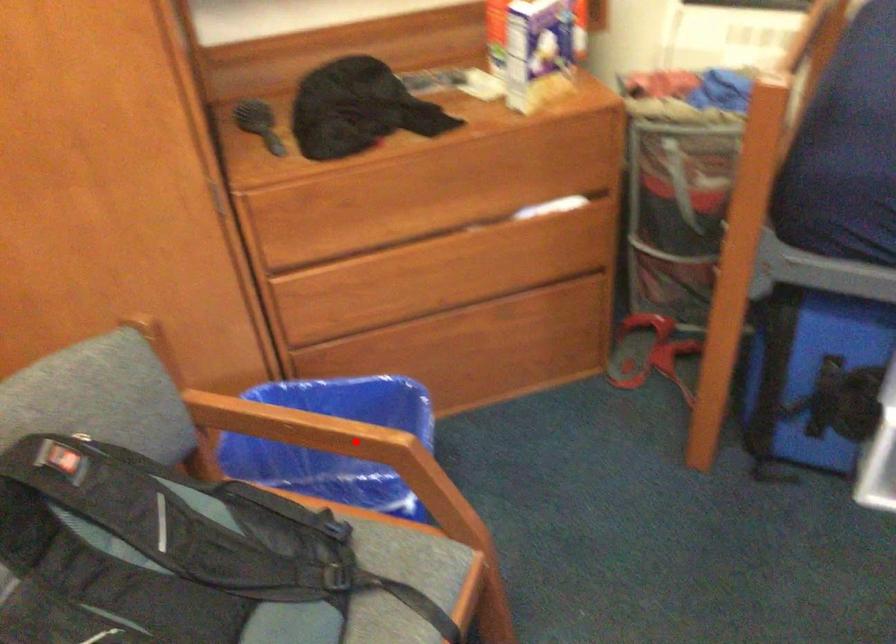
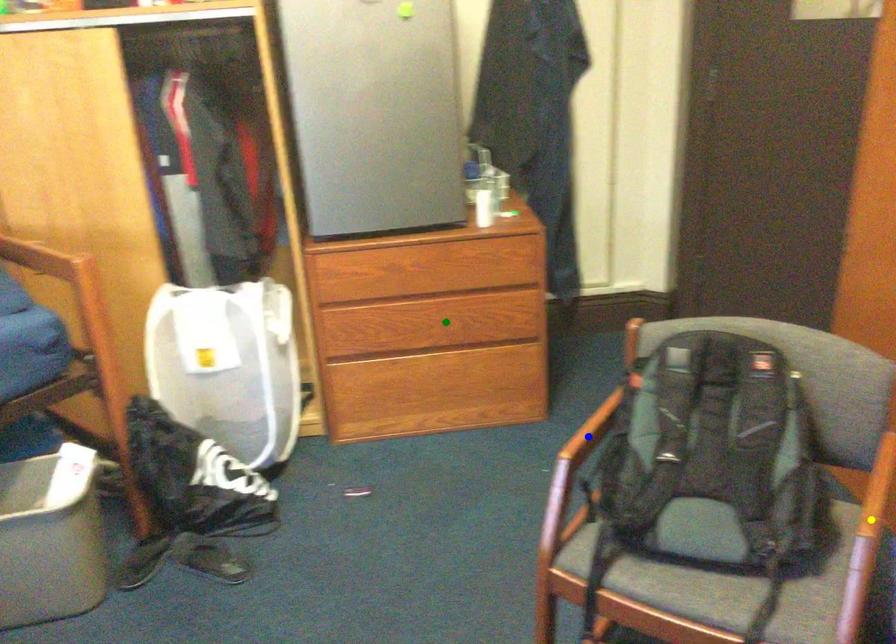
Question: I am providing you with two images of the same scene from different viewpoints. A red point is marked on the first image. You are given multiple points on the second image. Can you choose the point in image 2 that corresponds to the point in image 1?

Choices:
 (A) yellow point
 (B) blue point
 (C) green point

Answer: (A)